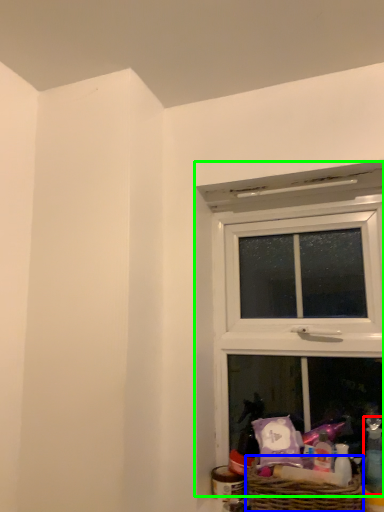
Question: Which is nearer to the toiletry (highlighted by a red box)? picnic basket (highlighted by a blue box) or window (highlighted by a green box).

Choices:
 (A) picnic basket
 (B) window

Answer: (A)